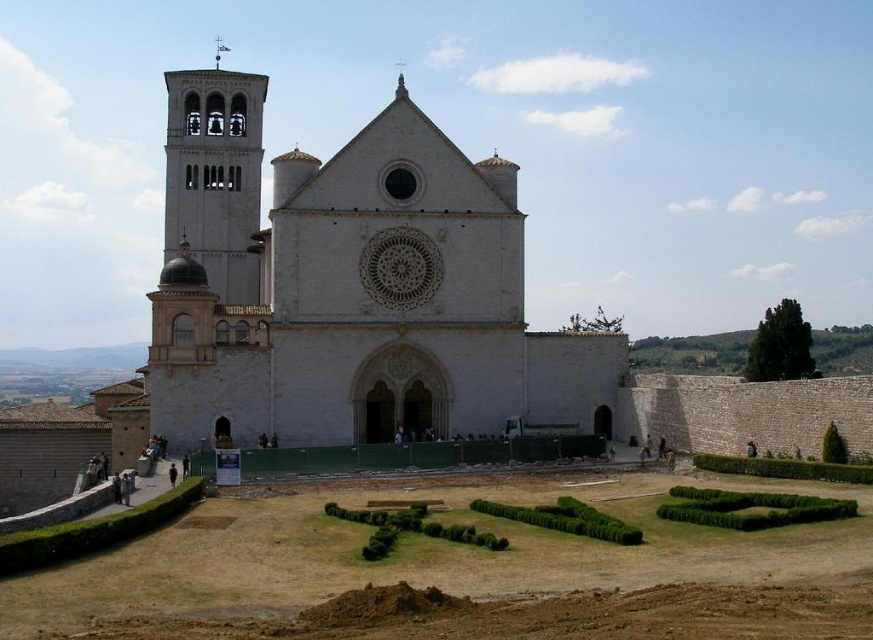
Based on the photo, does white stone church at center have a smaller size compared to green shrubbery at center?

Actually, white stone church at center might be larger than green shrubbery at center.

Does point (383, 340) come in front of point (353, 516)?

No, (383, 340) is further to viewer.

Where is `white stone church at center`? white stone church at center is located at coordinates (349, 289).

Does green leafy hedge at lower right appear on the right side of dark brown leather jacket at lower right?

Indeed, green leafy hedge at lower right is positioned on the right side of dark brown leather jacket at lower right.

Who is more forward, (789, 458) or (753, 442)?

Positioned in front is point (789, 458).

What are the coordinates of `green leafy hedge at lower right` in the screenshot? It's located at (784, 468).

Locate an element on the screen. The height and width of the screenshot is (640, 873). green leafy hedge at lower right is located at coordinates (784, 468).

Can you confirm if green leafy hedge at lower right is positioned below dark brown leather jacket at lower left?

Actually, green leafy hedge at lower right is above dark brown leather jacket at lower left.

Is green leafy hedge at lower right further to the viewer compared to dark brown leather jacket at lower left?

That is False.

Where is `green leafy hedge at lower right`? green leafy hedge at lower right is located at coordinates (784, 468).